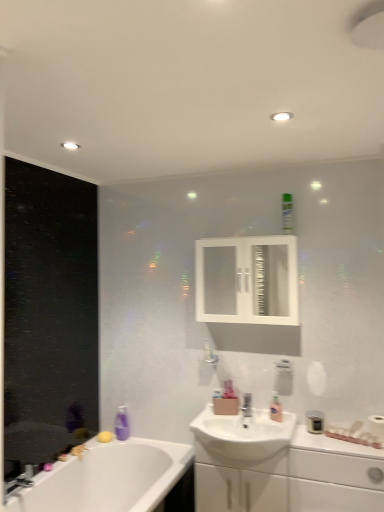
Question: Which direction should I rotate to look at pink glossy lotion at sink, marked as the 2th toiletry in a bottom-to-top arrangement?

Choices:
 (A) right
 (B) left

Answer: (A)

Question: From a real-world perspective, is white glossy medicine cabinet at upper center on white glossy sink at center?

Choices:
 (A) yes
 (B) no

Answer: (A)

Question: Is white glossy medicine cabinet at upper center bigger than white glossy sink at center?

Choices:
 (A) yes
 (B) no

Answer: (A)

Question: Is white glossy medicine cabinet at upper center looking in the opposite direction of white glossy sink at center?

Choices:
 (A) yes
 (B) no

Answer: (B)

Question: Is white glossy medicine cabinet at upper center in front of white glossy sink at center?

Choices:
 (A) yes
 (B) no

Answer: (B)

Question: Is there a large distance between white glossy medicine cabinet at upper center and white glossy sink at center?

Choices:
 (A) yes
 (B) no

Answer: (B)

Question: Is white glossy medicine cabinet at upper center aimed at white glossy sink at center?

Choices:
 (A) yes
 (B) no

Answer: (B)

Question: Does white glossy cabinet at lower right have a greater width compared to purple plastic soap dispenser at lower left?

Choices:
 (A) no
 (B) yes

Answer: (B)

Question: Is white glossy cabinet at lower right at the right side of purple plastic soap dispenser at lower left?

Choices:
 (A) yes
 (B) no

Answer: (A)

Question: Could you tell me if white glossy cabinet at lower right is facing purple plastic soap dispenser at lower left?

Choices:
 (A) yes
 (B) no

Answer: (B)

Question: Is white glossy cabinet at lower right positioned far away from purple plastic soap dispenser at lower left?

Choices:
 (A) no
 (B) yes

Answer: (B)

Question: From the image's perspective, is white glossy cabinet at lower right above purple plastic soap dispenser at lower left?

Choices:
 (A) no
 (B) yes

Answer: (A)

Question: Can you confirm if white glossy cabinet at lower right is shorter than purple plastic soap dispenser at lower left?

Choices:
 (A) yes
 (B) no

Answer: (B)

Question: From the image's perspective, is white glossy medicine cabinet at upper center on top of matte black canister at lower right, which is the 1th toiletry from right to left?

Choices:
 (A) yes
 (B) no

Answer: (A)